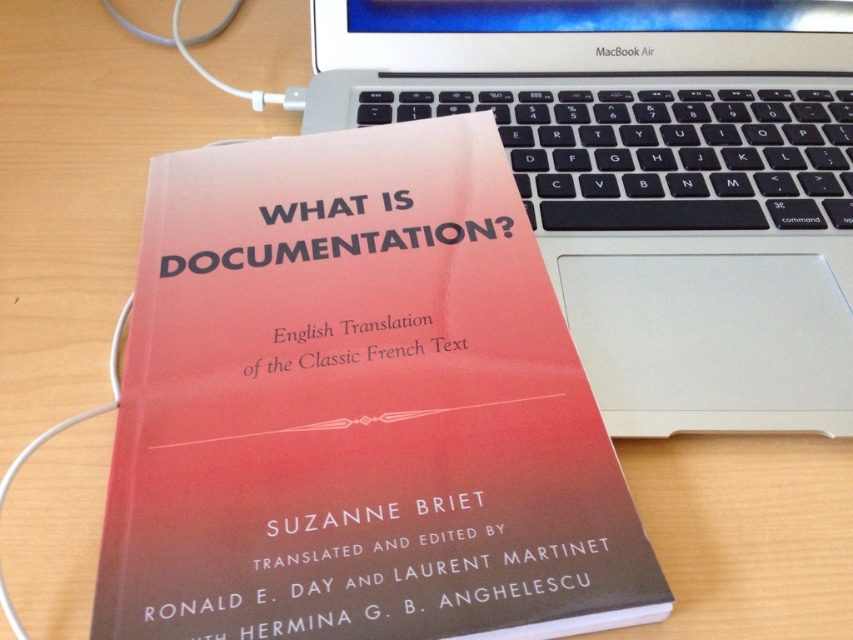
Question: Which object appears farthest from the camera in this image?

Choices:
 (A) matte paper book at center
 (B) sleek silver laptop at upper center

Answer: (B)

Question: Is matte paper book at center further to camera compared to sleek silver laptop at upper center?

Choices:
 (A) no
 (B) yes

Answer: (A)

Question: Which object is closer to the camera taking this photo?

Choices:
 (A) matte paper book at center
 (B) sleek silver laptop at upper center

Answer: (A)

Question: Can you confirm if matte paper book at center is smaller than sleek silver laptop at upper center?

Choices:
 (A) yes
 (B) no

Answer: (A)

Question: Can you confirm if matte paper book at center is bigger than sleek silver laptop at upper center?

Choices:
 (A) no
 (B) yes

Answer: (A)